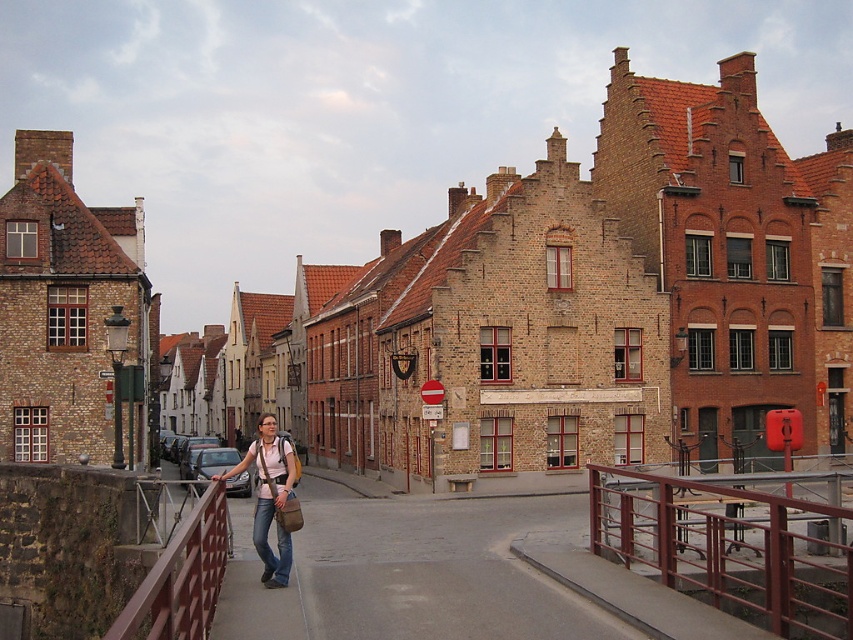
Question: Which object is closer to the camera taking this photo?

Choices:
 (A) brown brick building at center
 (B) matte pink shirt at center
 (C) metallic red railing at center
 (D) brown metal/rail at center

Answer: (D)

Question: Can you confirm if metallic red railing at center is positioned to the right of matte pink shirt at center?

Choices:
 (A) no
 (B) yes

Answer: (B)

Question: Which of the following is the closest to the observer?

Choices:
 (A) (769, 429)
 (B) (271, 561)

Answer: (B)

Question: Is metallic red railing at center smaller than matte pink shirt at center?

Choices:
 (A) no
 (B) yes

Answer: (B)

Question: Based on their relative distances, which object is nearer to the brown metal/rail at center?

Choices:
 (A) brown brick building at center
 (B) matte pink shirt at center

Answer: (B)

Question: Can you confirm if brown brick building at center is positioned to the right of brown metal/rail at center?

Choices:
 (A) no
 (B) yes

Answer: (B)